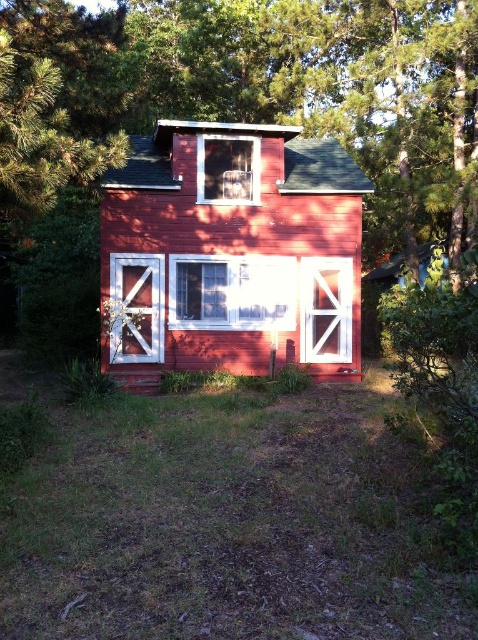
Does green textured tree at upper center appear on the left side of smooth red barn at center?

Yes, green textured tree at upper center is to the left of smooth red barn at center.

Can you confirm if green textured tree at upper center is positioned above smooth red barn at center?

Indeed, green textured tree at upper center is positioned over smooth red barn at center.

Find the location of `green textured tree at upper center`. green textured tree at upper center is located at coordinates (288, 83).

The height and width of the screenshot is (640, 478). Identify the location of green textured tree at upper center. (288, 83).

Consider the image. Can you confirm if green textured tree at upper center is wider than white wood barn door at lower left?

Yes.

Between green textured tree at upper center and white wood barn door at lower left, which one appears on the left side from the viewer's perspective?

Positioned to the left is white wood barn door at lower left.

Between point (413, 19) and point (129, 342), which one is positioned behind?

The point (413, 19) is behind.

Identify the location of green textured tree at upper center. (288, 83).

Is point (317, 337) positioned before point (137, 308)?

No, it is behind (137, 308).

Does smooth red barn at center have a greater height compared to white wood barn door at lower left?

No, smooth red barn at center is not taller than white wood barn door at lower left.

Which is behind, point (359, 253) or point (144, 285)?

Positioned behind is point (359, 253).

Find the location of `smooth red barn at center`. smooth red barn at center is located at coordinates (230, 252).